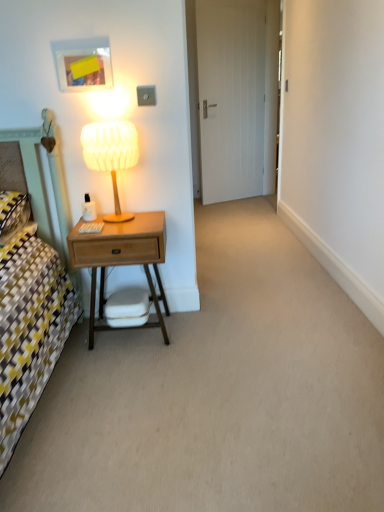
This screenshot has width=384, height=512. What are the coordinates of `free space in front of white matte door at center` in the screenshot? It's located at (241, 207).